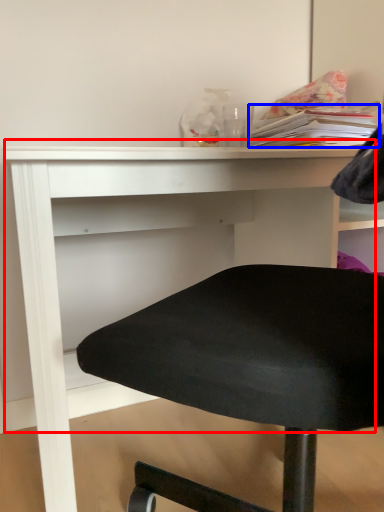
Question: Which of the following is the farthest to the observer, table (highlighted by a red box) or book (highlighted by a blue box)?

Choices:
 (A) table
 (B) book

Answer: (B)